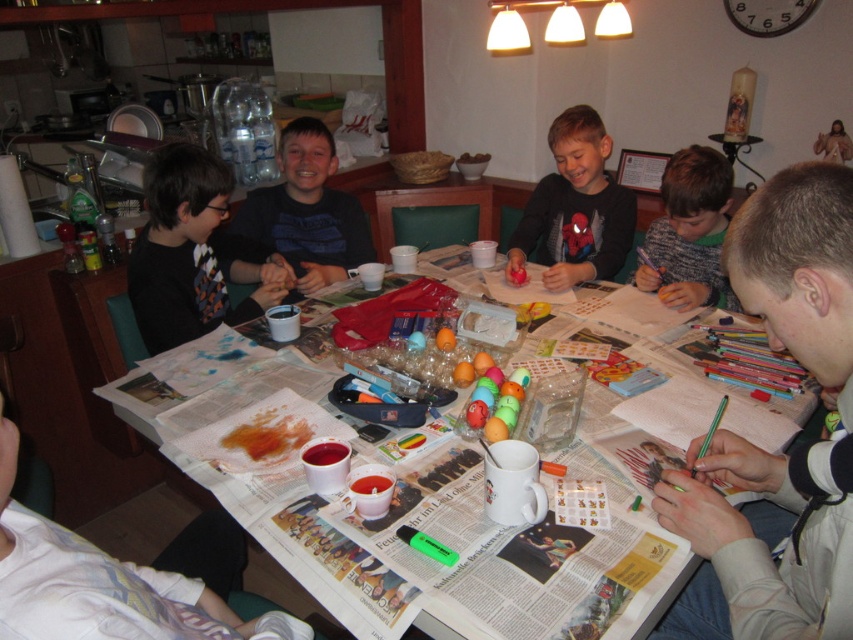
Who is positioned more to the right, white cotton shirt at lower left or knitted sweater at center?

knitted sweater at center

Does white cotton shirt at lower left come behind knitted sweater at center?

No, white cotton shirt at lower left is in front of knitted sweater at center.

Is point (189, 634) more distant than point (689, 147)?

No, (189, 634) is in front of (689, 147).

This screenshot has width=853, height=640. I want to click on white cotton shirt at lower left, so click(102, 582).

Who is positioned more to the right, striped sweater at center or newspaper-covered table at center?

newspaper-covered table at center

Identify the location of striped sweater at center. (306, 211).

Measure the distance between smooth gray shirt at lower right and knitted sweater at center.

smooth gray shirt at lower right is 37.59 inches away from knitted sweater at center.

Who is taller, smooth gray shirt at lower right or knitted sweater at center?

smooth gray shirt at lower right

You are a GUI agent. You are given a task and a screenshot of the screen. Output one action in this format:
    pyautogui.click(x=<x>, y=<y>)
    Task: Click on the smooth gray shirt at lower right
    The height and width of the screenshot is (640, 853).
    Given the screenshot: What is the action you would take?
    pyautogui.click(x=775, y=454)

The height and width of the screenshot is (640, 853). In order to click on smooth gray shirt at lower right in this screenshot , I will do `click(775, 454)`.